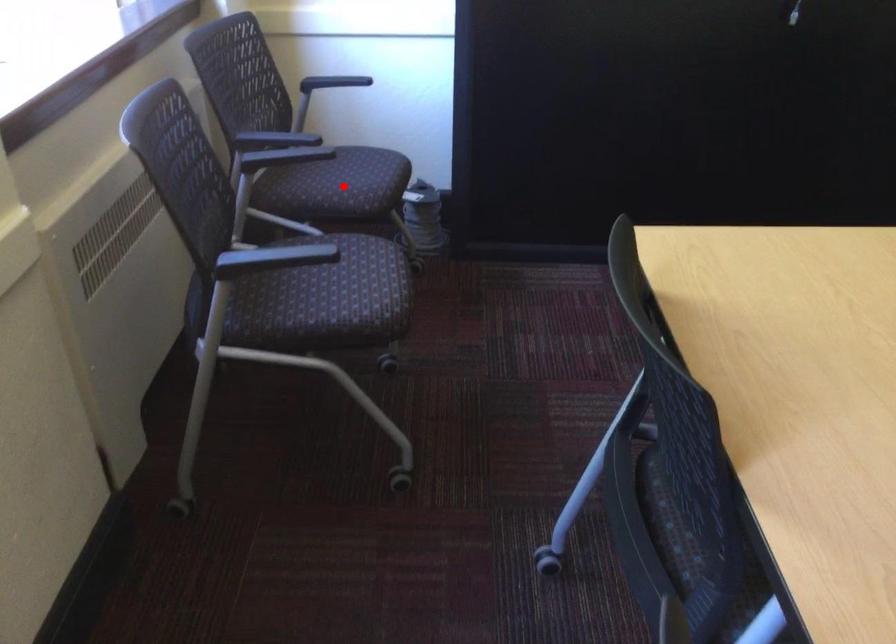
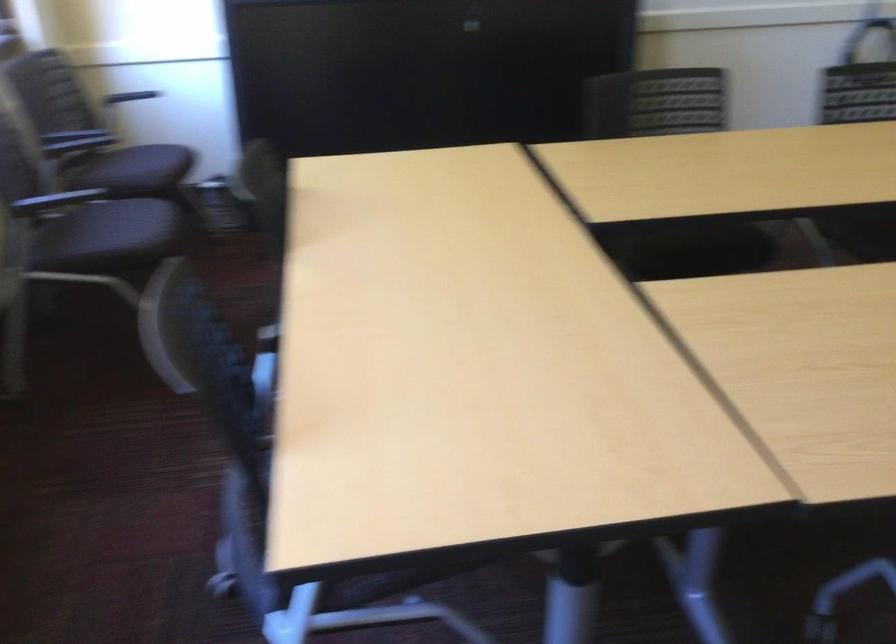
In the second image, find the point that corresponds to the highlighted location in the first image.

(135, 169)